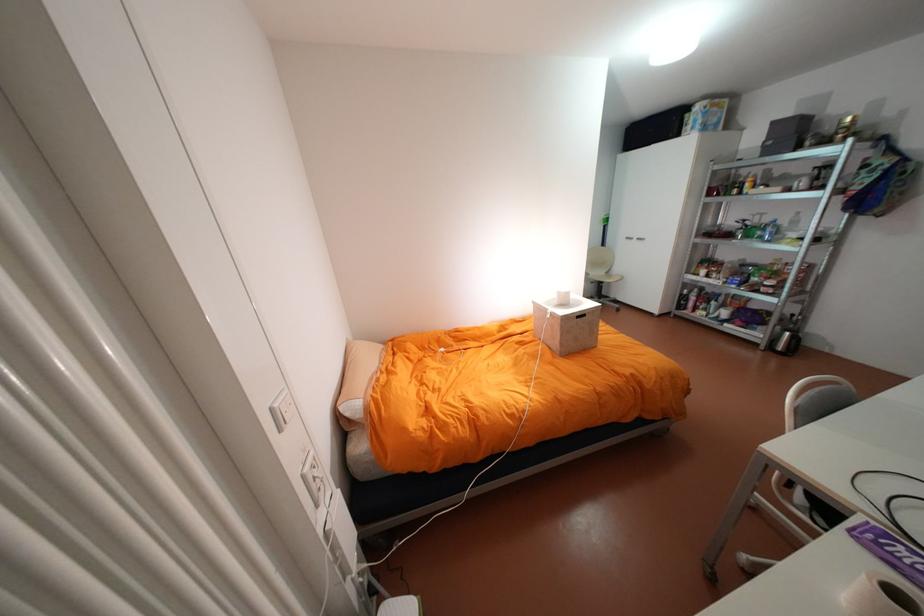
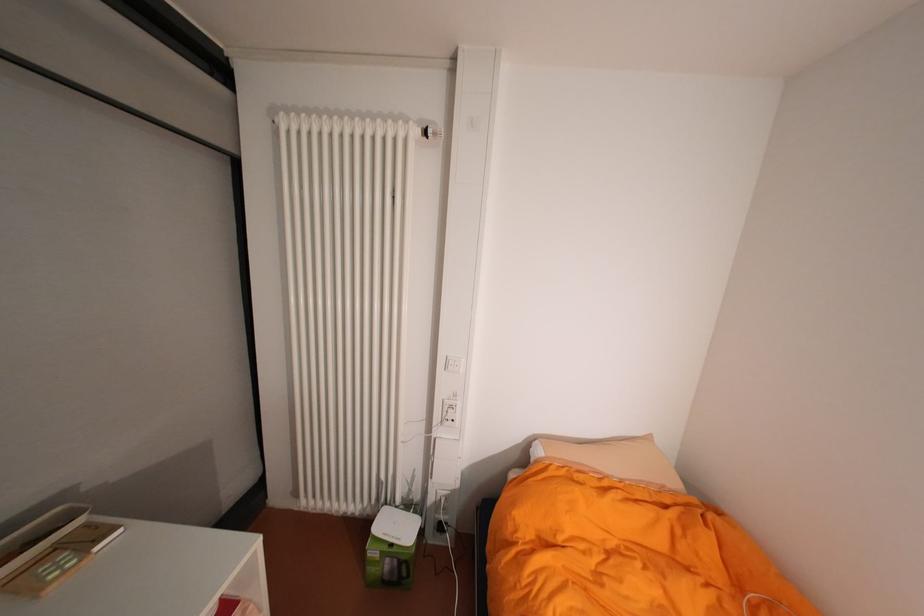
Locate, in the second image, the point that corresponds to pixel 371 399 in the first image.

(553, 454)